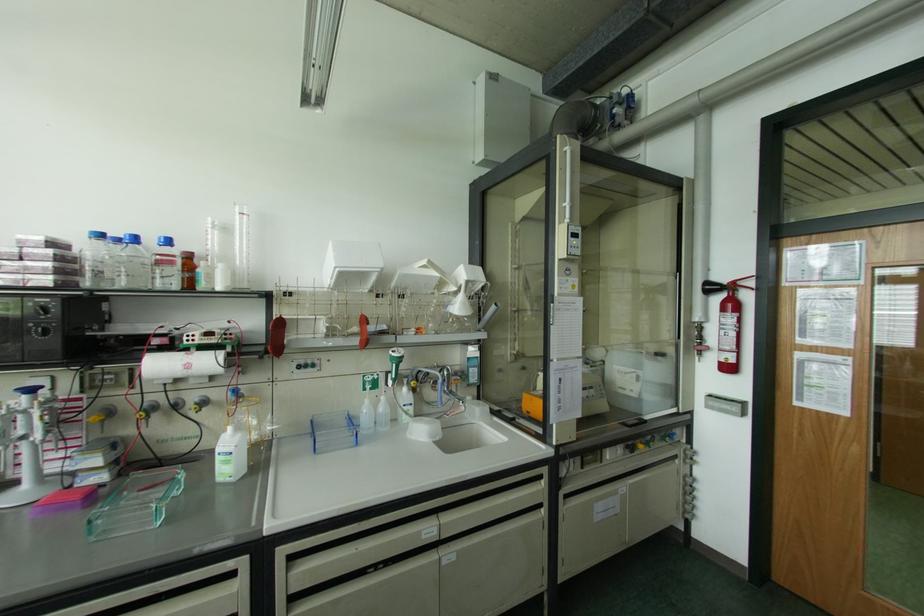
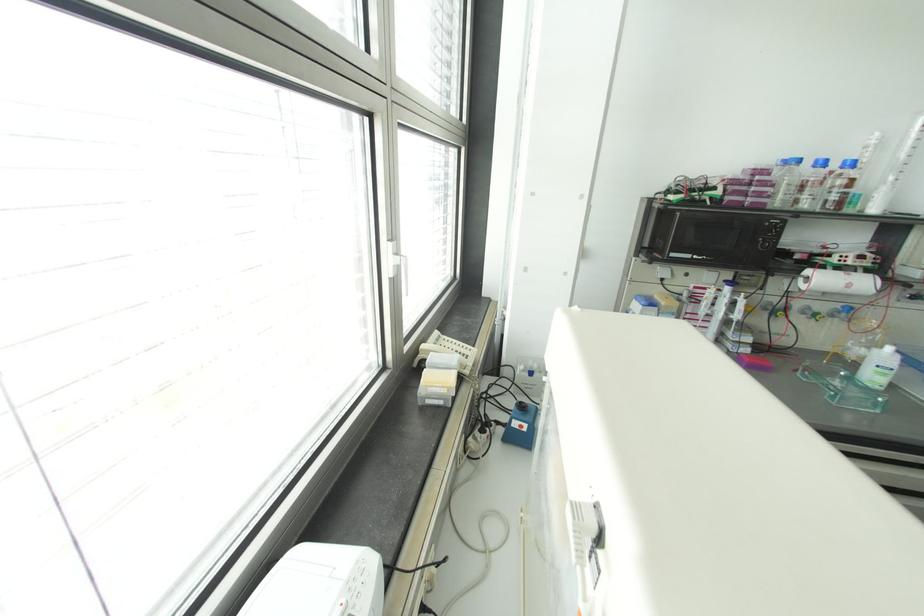
Find the pixel in the second image that matches [238,435] in the first image.

(898, 355)